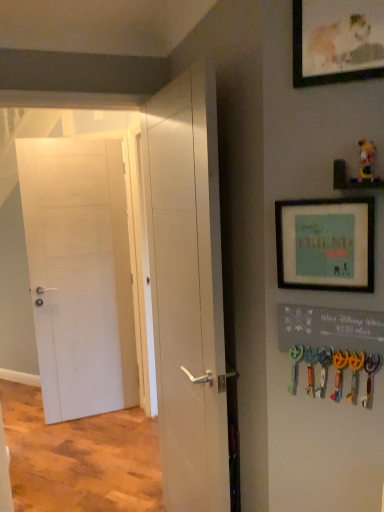
Find the location of a particular element. empty space that is to the right of white matte door at left, which is counted as the first door, starting from the back is located at coordinates (129, 419).